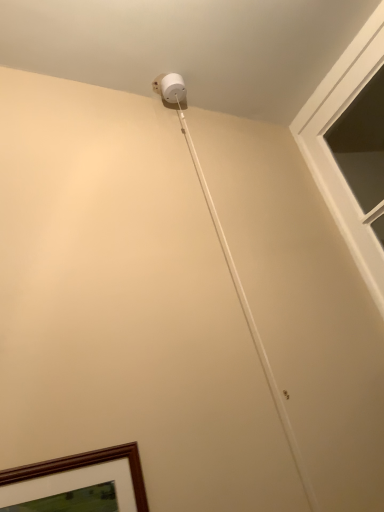
Find the location of `white matte string at upper center`. white matte string at upper center is located at coordinates (249, 318).

What do you see at coordinates (249, 318) in the screenshot? I see `white matte string at upper center` at bounding box center [249, 318].

What do you see at coordinates (331, 153) in the screenshot? Image resolution: width=384 pixels, height=512 pixels. I see `clear glass window at upper right` at bounding box center [331, 153].

Where is `clear glass window at upper right`? The width and height of the screenshot is (384, 512). clear glass window at upper right is located at coordinates (331, 153).

This screenshot has width=384, height=512. In order to click on white matte string at upper center in this screenshot , I will do `click(249, 318)`.

Can you confirm if clear glass window at upper right is positioned to the left of white matte string at upper center?

No.

Does clear glass window at upper right lie behind white matte string at upper center?

Yes, the depth of clear glass window at upper right is greater than that of white matte string at upper center.

Is point (301, 118) more distant than point (296, 457)?

Yes.

From the image's perspective, would you say clear glass window at upper right is positioned over white matte string at upper center?

Yes, from the image's perspective, clear glass window at upper right is over white matte string at upper center.

From a real-world perspective, is clear glass window at upper right physically located above or below white matte string at upper center?

clear glass window at upper right is situated higher than white matte string at upper center in the real world.

Looking at this image, can you confirm if clear glass window at upper right is thinner than white matte string at upper center?

No.

Considering the sizes of objects clear glass window at upper right and white matte string at upper center in the image provided, who is shorter, clear glass window at upper right or white matte string at upper center?

Standing shorter between the two is clear glass window at upper right.

Considering the relative sizes of clear glass window at upper right and white matte string at upper center in the image provided, is clear glass window at upper right smaller than white matte string at upper center?

No, clear glass window at upper right is not smaller than white matte string at upper center.

Would you say clear glass window at upper right is outside white matte string at upper center?

Yes, clear glass window at upper right is not within white matte string at upper center.

Is clear glass window at upper right beside white matte string at upper center?

There is a gap between clear glass window at upper right and white matte string at upper center.

Is clear glass window at upper right positioned with its back to white matte string at upper center?

No, white matte string at upper center is not at the back of clear glass window at upper right.

How many degrees apart are the facing directions of clear glass window at upper right and white matte string at upper center?

The facing directions of clear glass window at upper right and white matte string at upper center are 89.1 degrees apart.

Where is `window on the right of the white matte string at upper center`? window on the right of the white matte string at upper center is located at coordinates (331, 153).

Between white matte string at upper center and clear glass window at upper right, which one appears on the left side from the viewer's perspective?

From the viewer's perspective, white matte string at upper center appears more on the left side.

Which object is further away from the camera, white matte string at upper center or clear glass window at upper right?

clear glass window at upper right is further away from the camera.

Is point (191, 144) closer or farther from the camera than point (331, 154)?

Point (191, 144) appears to be closer to the viewer than point (331, 154).

Consider the image. From the image's perspective, which object appears higher, white matte string at upper center or clear glass window at upper right?

From the image's view, clear glass window at upper right is above.

From a real-world perspective, which object rests below the other?

white matte string at upper center, from a real-world perspective.

Considering the sizes of white matte string at upper center and clear glass window at upper right in the image, is white matte string at upper center wider or thinner than clear glass window at upper right?

In the image, white matte string at upper center appears to be more narrow than clear glass window at upper right.

Considering the sizes of white matte string at upper center and clear glass window at upper right in the image, is white matte string at upper center taller or shorter than clear glass window at upper right?

Clearly, white matte string at upper center is taller compared to clear glass window at upper right.

Considering the sizes of white matte string at upper center and clear glass window at upper right in the image, is white matte string at upper center bigger or smaller than clear glass window at upper right?

Clearly, white matte string at upper center is smaller in size than clear glass window at upper right.

Can clear glass window at upper right be found inside white matte string at upper center?

Actually, clear glass window at upper right is outside white matte string at upper center.

Is white matte string at upper center not close to clear glass window at upper right?

No.

Is white matte string at upper center positioned with its back to clear glass window at upper right?

No, white matte string at upper center's orientation is not away from clear glass window at upper right.

How many degrees apart are the facing directions of white matte string at upper center and clear glass window at upper right?

They differ by 89.1 degrees in their facing directions.

How far apart are white matte string at upper center and clear glass window at upper right?

white matte string at upper center is 47.90 centimeters from clear glass window at upper right.

The height and width of the screenshot is (512, 384). I want to click on window that is above the white matte string at upper center (from a real-world perspective), so click(331, 153).

You are a GUI agent. You are given a task and a screenshot of the screen. Output one action in this format:
    pyautogui.click(x=<x>, y=<y>)
    Task: Click on the window lying above the white matte string at upper center (from the image's perspective)
    The width and height of the screenshot is (384, 512).
    Given the screenshot: What is the action you would take?
    pyautogui.click(x=331, y=153)

Image resolution: width=384 pixels, height=512 pixels. Identify the location of string below the clear glass window at upper right (from a real-world perspective). (x=249, y=318).